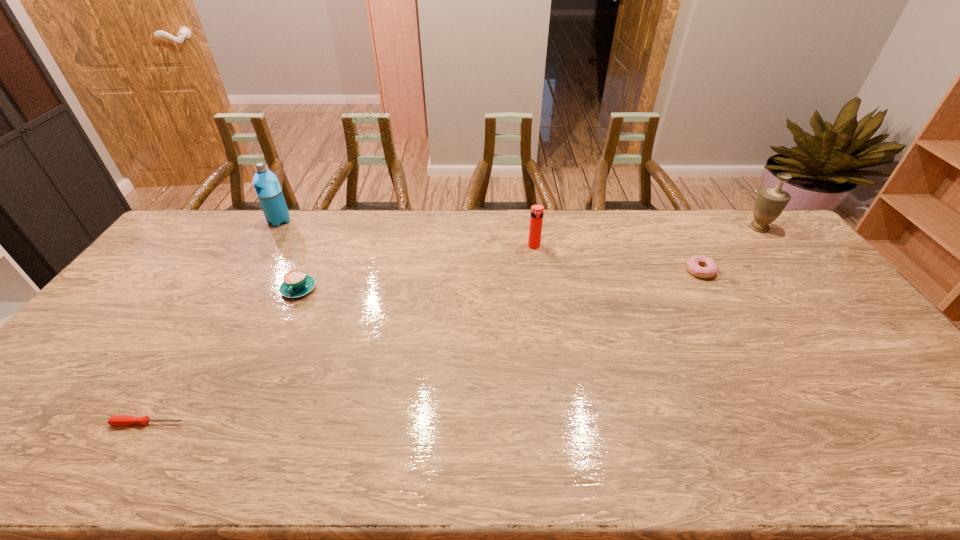
This screenshot has height=540, width=960. What are the coordinates of `the farther thermos bottle` in the screenshot? It's located at (267, 187).

Where is `the taller thermos bottle`? Image resolution: width=960 pixels, height=540 pixels. the taller thermos bottle is located at coordinates (267, 187).

The width and height of the screenshot is (960, 540). Identify the location of the rightmost object. (771, 201).

What are the coordinates of `the right thermos bottle` in the screenshot? It's located at (536, 219).

This screenshot has height=540, width=960. In order to click on the fourth shortest object in this screenshot , I will do point(536,219).

Where is `cappuccino`? Image resolution: width=960 pixels, height=540 pixels. cappuccino is located at coordinates (296, 283).

This screenshot has height=540, width=960. I want to click on the third object from left to right, so click(x=296, y=283).

Locate an element on the screen. The width and height of the screenshot is (960, 540). the fifth object from left to right is located at coordinates pyautogui.click(x=694, y=263).

The height and width of the screenshot is (540, 960). I want to click on the second shortest object, so click(x=694, y=263).

Image resolution: width=960 pixels, height=540 pixels. I want to click on the nearest object, so tap(116, 420).